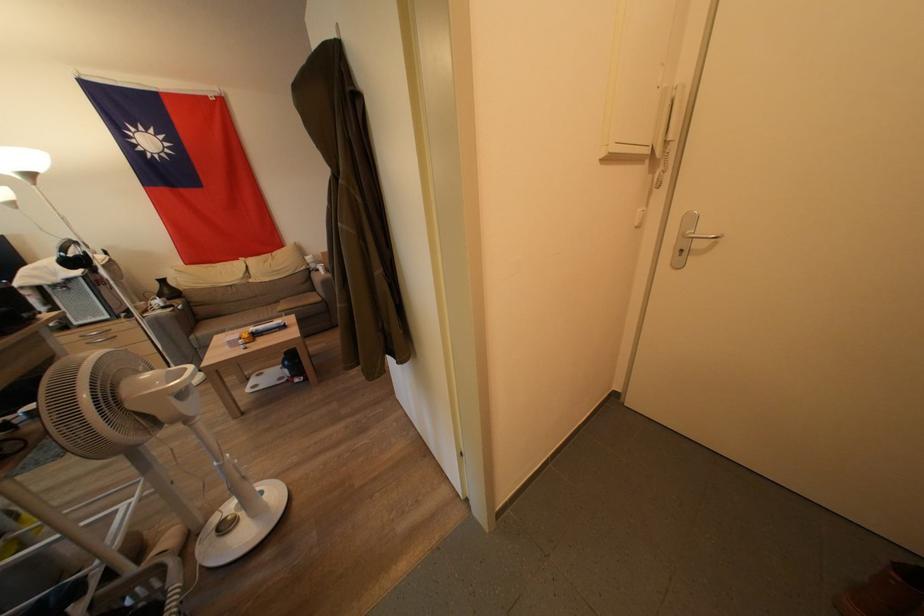
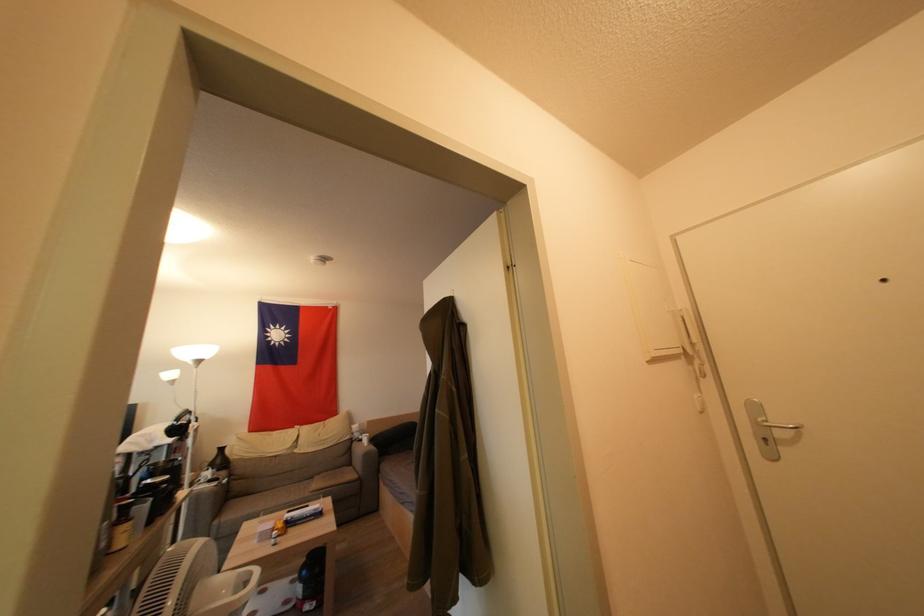
Find the pixel in the second image that matches (x=197, y=341) in the first image.

(221, 525)